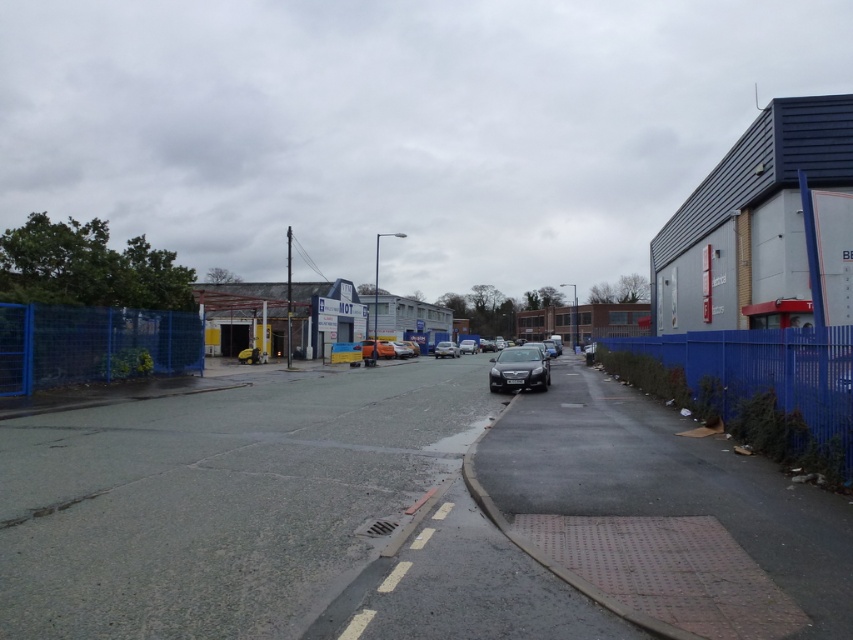
Question: Can you confirm if blue metal fence at right is positioned to the right of shiny silver car at center?

Choices:
 (A) yes
 (B) no

Answer: (A)

Question: Which of the following is the farthest from the observer?

Choices:
 (A) (811, 360)
 (B) (167, 317)
 (C) (444, 348)
 (D) (386, 353)

Answer: (C)

Question: Is blue metal fence at right positioned behind orange matte car at center?

Choices:
 (A) no
 (B) yes

Answer: (A)

Question: Among these points, which one is farthest from the camera?

Choices:
 (A) (524, 372)
 (B) (821, 388)
 (C) (444, 349)

Answer: (C)

Question: Is blue mesh fence at lower left to the left of satin black car at center from the viewer's perspective?

Choices:
 (A) yes
 (B) no

Answer: (A)

Question: Which object appears farthest from the camera in this image?

Choices:
 (A) blue metal fence at right
 (B) orange matte car at center
 (C) shiny silver car at center

Answer: (C)